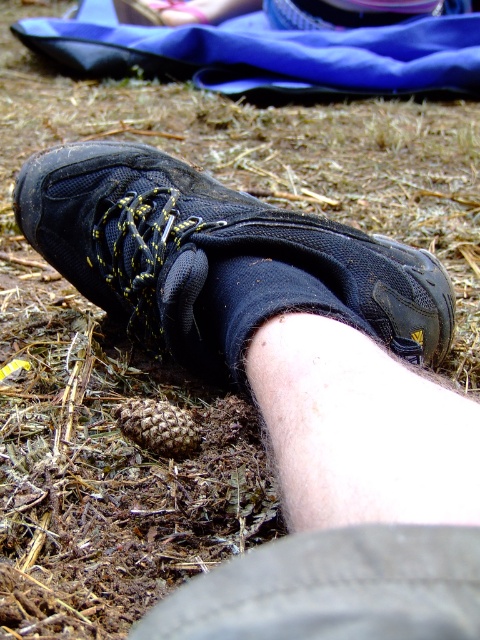
Is point (109, 285) more distant than point (251, 298)?

Yes, it is behind point (251, 298).

Is point (301, 301) in front of point (360, 328)?

That is True.

Where is `matte black shoe at lower left`? matte black shoe at lower left is located at coordinates (217, 259).